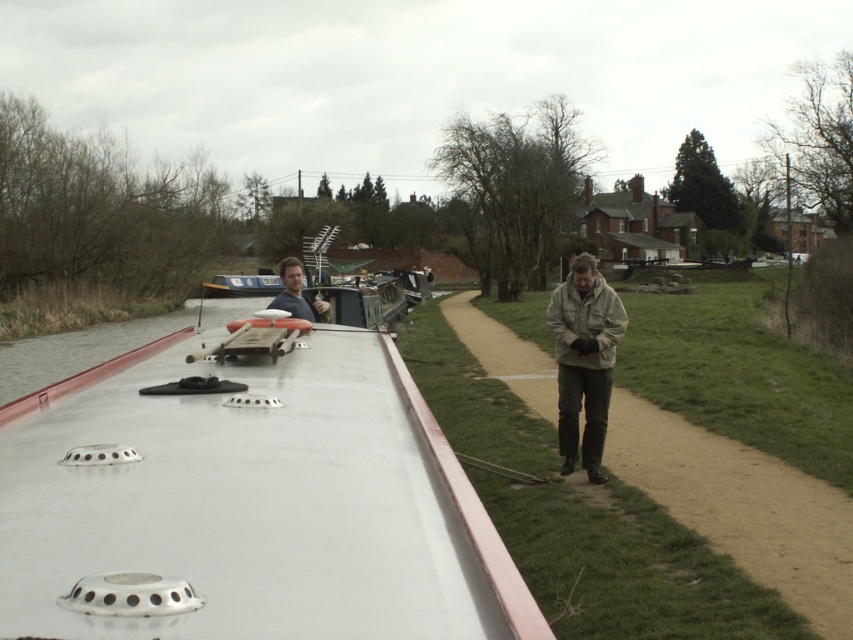
You are standing on the riverside path and see the white glossy boat at left and the blue glossy boat at center. Which boat is positioned closer to the water surface?

The white glossy boat at left is positioned closer to the water surface because it is below the blue glossy boat at center.

You are standing on the riverside and want to board the white glossy boat at left. Can you reach the boat by taking two steps if each of your steps is 3 feet long?

The distance between you and the white glossy boat at left is 3.99 feet. Since each step is 3 feet long, one step would cover most of the distance, and the remaining 0.99 feet can be covered by a small step or a stretch. Therefore, you can reach the boat with two steps.

You are standing on the dock looking at the tan fabric jacket at right and the matte gray shirt at center. Which item is nearer to you?

The tan fabric jacket at right is closer to the viewer than the matte gray shirt at center.